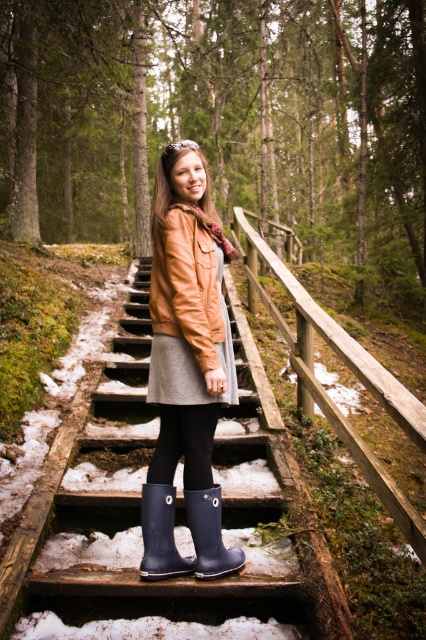
Question: Is wooden rail at center positioned behind leather jacket at center?

Choices:
 (A) no
 (B) yes

Answer: (A)

Question: Which point is farther from the camera taking this photo?

Choices:
 (A) (207, 237)
 (B) (155, 483)

Answer: (B)

Question: Which point is farther to the camera?

Choices:
 (A) (55, 198)
 (B) (166, 316)
 (C) (163, 548)

Answer: (A)

Question: Is navy rubber boot at center positioned behind blue rubber boot at center?

Choices:
 (A) yes
 (B) no

Answer: (A)

Question: Can you confirm if leather jacket at center is bigger than blue rubber boot at center?

Choices:
 (A) no
 (B) yes

Answer: (B)

Question: Which of these objects is positioned farthest from the matte leather jacket at center?

Choices:
 (A) wooden rail at center
 (B) leather jacket at center

Answer: (A)